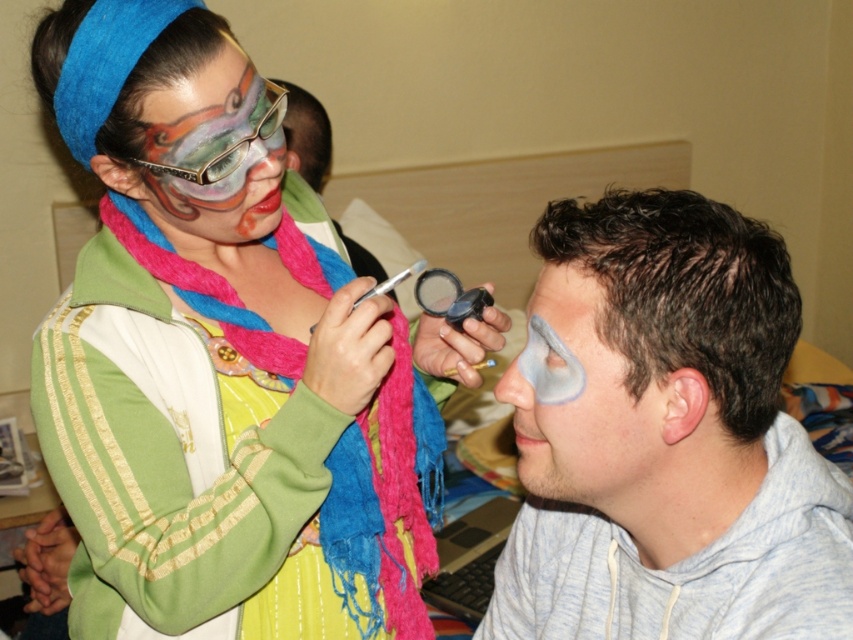
Question: Can you confirm if matte multicolored scarf at upper left is wider than matte black face paint at upper center?

Choices:
 (A) yes
 (B) no

Answer: (A)

Question: Among these objects, which one is farthest from the camera?

Choices:
 (A) multicolored painted face at upper left
 (B) transparent plastic magnifying glass at upper center
 (C) matte gray face paint at right
 (D) matte multicolored scarf at upper left

Answer: (B)

Question: Is matte multicolored scarf at upper left wider than matte black face paint at upper center?

Choices:
 (A) yes
 (B) no

Answer: (A)

Question: Estimate the real-world distances between objects in this image. Which object is farther from the multicolored painted face at upper left?

Choices:
 (A) matte black face paint at upper center
 (B) transparent plastic magnifying glass at upper center
 (C) matte gray face paint at right
 (D) matte multicolored scarf at upper left

Answer: (A)

Question: Can you confirm if matte black face paint at upper center is positioned below transparent plastic magnifying glass at upper center?

Choices:
 (A) yes
 (B) no

Answer: (B)

Question: Which point appears closest to the camera in this image?

Choices:
 (A) (283, 81)
 (B) (582, 337)
 (C) (434, 314)

Answer: (B)